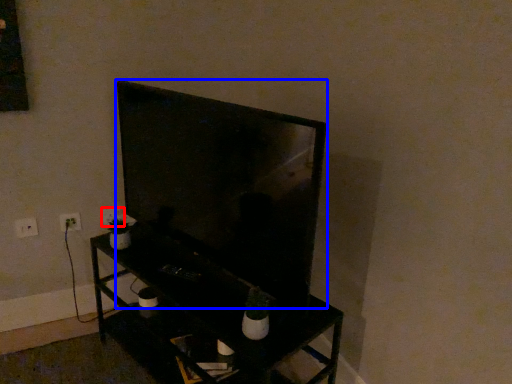
Question: Which object appears farthest to the camera in this image, electric outlet (highlighted by a red box) or television (highlighted by a blue box)?

Choices:
 (A) electric outlet
 (B) television

Answer: (A)